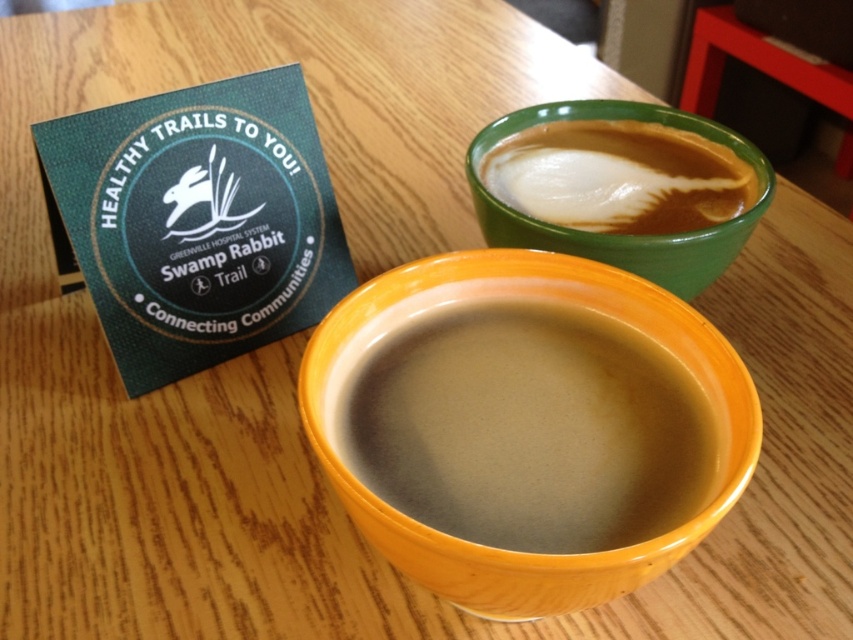
Question: Can you confirm if matte ceramic mug at center is positioned to the right of smooth green cup at upper right?

Choices:
 (A) yes
 (B) no

Answer: (B)

Question: Can you confirm if matte ceramic mug at center is positioned below smooth green cup at upper right?

Choices:
 (A) yes
 (B) no

Answer: (A)

Question: Which point is farther to the camera?

Choices:
 (A) matte ceramic mug at center
 (B) smooth green cup at upper right

Answer: (B)

Question: Does matte ceramic mug at center have a smaller size compared to smooth green cup at upper right?

Choices:
 (A) yes
 (B) no

Answer: (B)

Question: Which point is farther to the camera?

Choices:
 (A) (663, 170)
 (B) (664, 449)

Answer: (A)

Question: Which point is closer to the camera?

Choices:
 (A) (496, 369)
 (B) (624, 193)

Answer: (A)